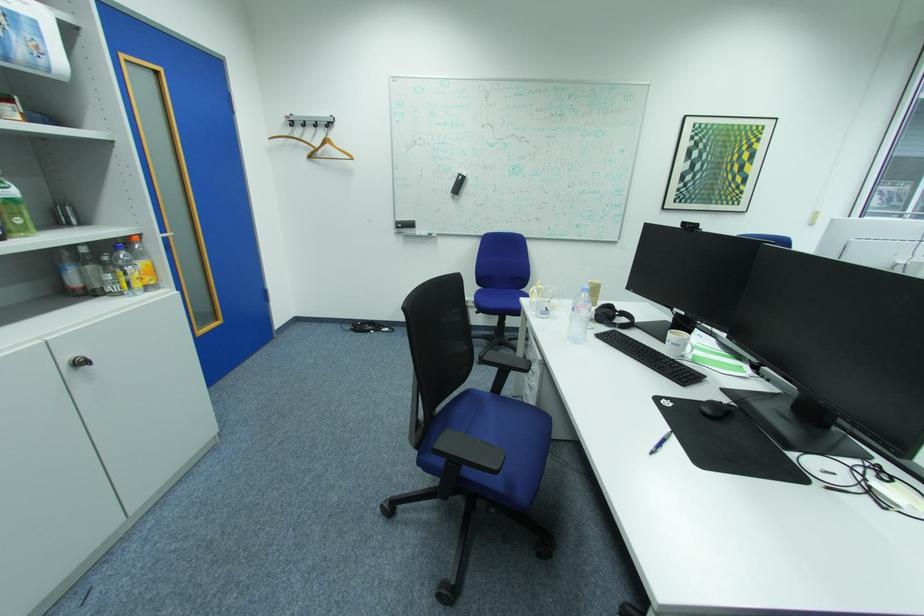
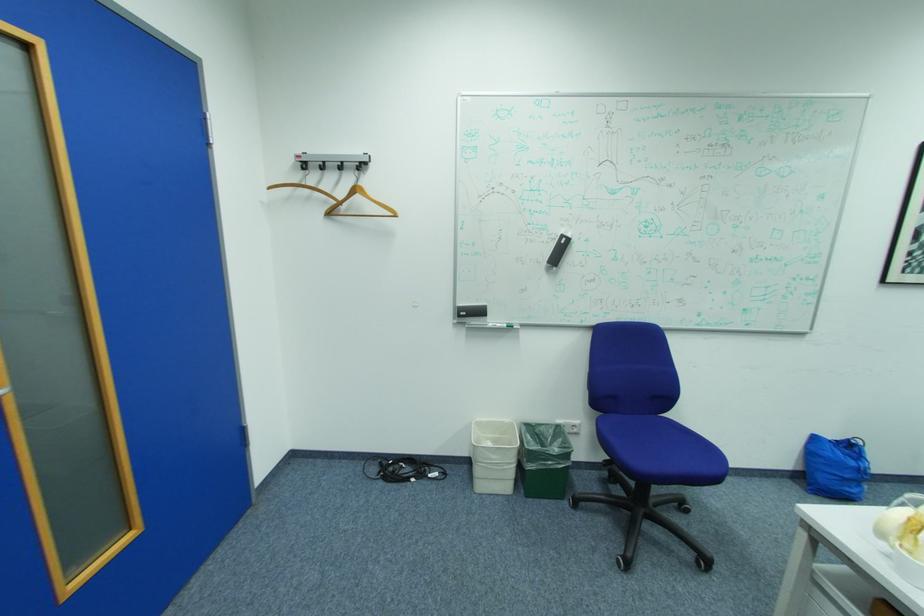
In the second image, find the point that corresponds to the point at 407,220 in the first image.

(469, 305)